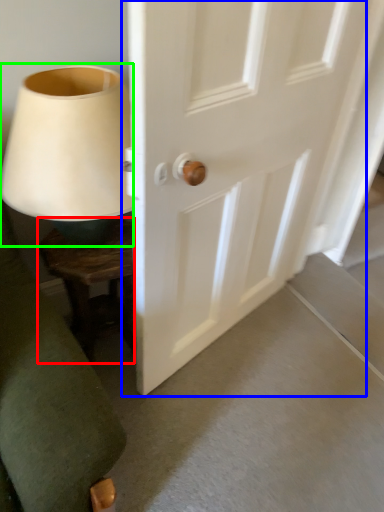
Question: Which object is the closest to the furniture (highlighted by a red box)? Choose among these: door (highlighted by a blue box) or table lamp (highlighted by a green box).

Choices:
 (A) door
 (B) table lamp

Answer: (B)